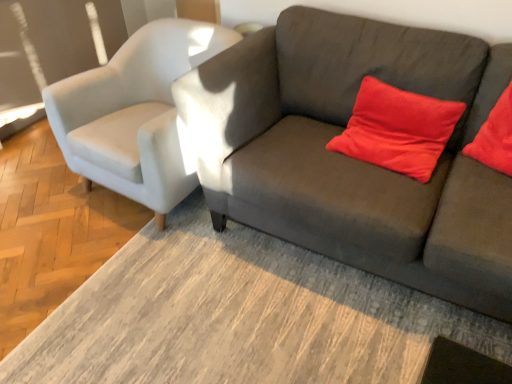
Question: Is dark gray fabric couch at center taller or shorter than satin white armchair at left?

Choices:
 (A) tall
 (B) short

Answer: (A)

Question: Considering their positions, is dark gray fabric couch at center located in front of or behind satin white armchair at left?

Choices:
 (A) behind
 (B) front

Answer: (B)

Question: Which of these objects is positioned farthest from the satin red pillow at upper right?

Choices:
 (A) satin white armchair at left
 (B) dark gray fabric couch at center

Answer: (A)

Question: Estimate the real-world distances between objects in this image. Which object is closer to the satin white armchair at left?

Choices:
 (A) dark gray fabric couch at center
 (B) satin red pillow at upper right

Answer: (A)